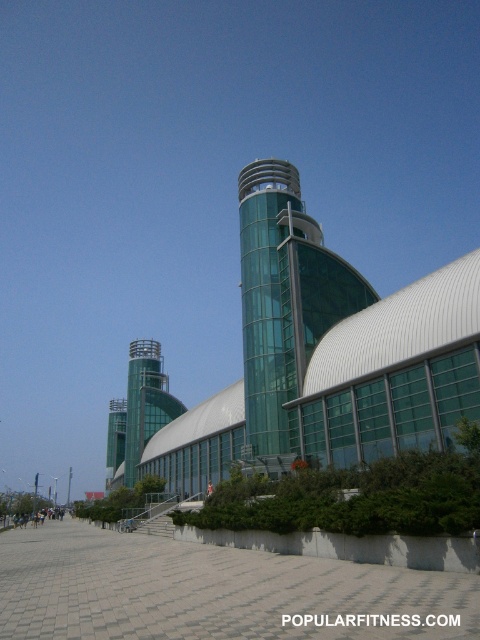
Question: Among these objects, which one is farthest from the camera?

Choices:
 (A) transparent glass tower at center
 (B) green glass tower at center

Answer: (B)

Question: Does transparent glass tower at center appear over green glass tower at center?

Choices:
 (A) no
 (B) yes

Answer: (B)

Question: Which point is farther from the camera taking this photo?

Choices:
 (A) (262, 332)
 (B) (126, 483)

Answer: (B)

Question: Is transparent glass tower at center wider than green glass tower at center?

Choices:
 (A) yes
 (B) no

Answer: (B)

Question: Does transparent glass tower at center appear on the left side of green glass tower at center?

Choices:
 (A) no
 (B) yes

Answer: (A)